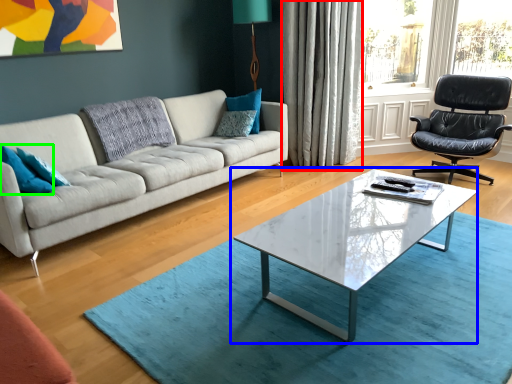
Question: Which object is the closest to the curtain (highlighted by a red box)? Choose among these: coffee table (highlighted by a blue box) or pillow (highlighted by a green box).

Choices:
 (A) coffee table
 (B) pillow

Answer: (A)